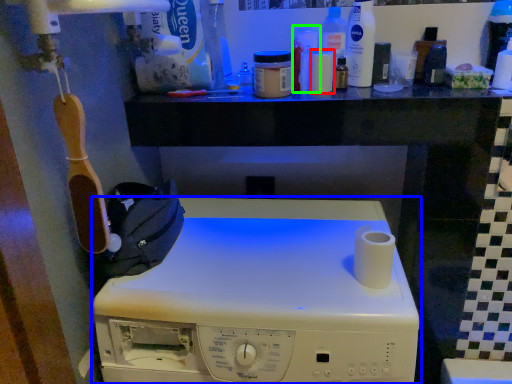
Question: Based on their relative distances, which object is farther from toiletry (highlighted by a red box)? Choose from home appliance (highlighted by a blue box) and toiletry (highlighted by a green box).

Choices:
 (A) home appliance
 (B) toiletry

Answer: (A)